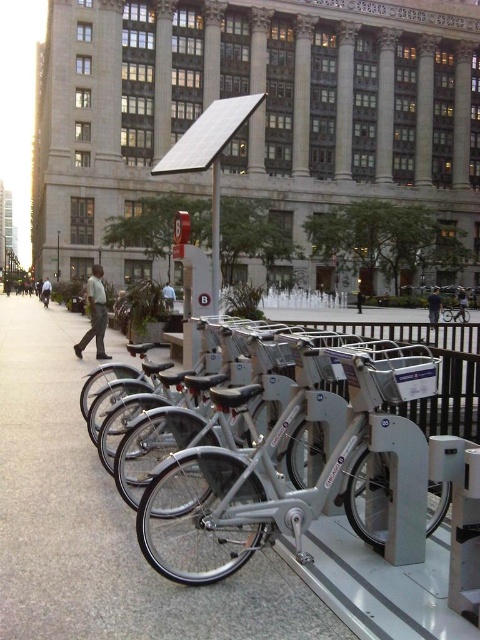
Question: Can you confirm if light brown leather pants at left is positioned to the left of black fabric person at center?

Choices:
 (A) no
 (B) yes

Answer: (B)

Question: Is silver metallic bicycle at center above light brown leather pants at left?

Choices:
 (A) no
 (B) yes

Answer: (A)

Question: Which of the following is the farthest from the observer?

Choices:
 (A) dark gray shirt at center
 (B) silver metallic bicycle at center
 (C) light brown leather pants at left

Answer: (A)

Question: Does dark gray shirt at center come in front of black fabric person at center?

Choices:
 (A) yes
 (B) no

Answer: (A)

Question: Among these points, which one is farthest from the camera?

Choices:
 (A) (45, 301)
 (B) (361, 296)

Answer: (B)

Question: Which point is farther to the camera?

Choices:
 (A) (104, 289)
 (B) (203, 592)
 (C) (167, 285)
 (D) (464, 314)

Answer: (C)